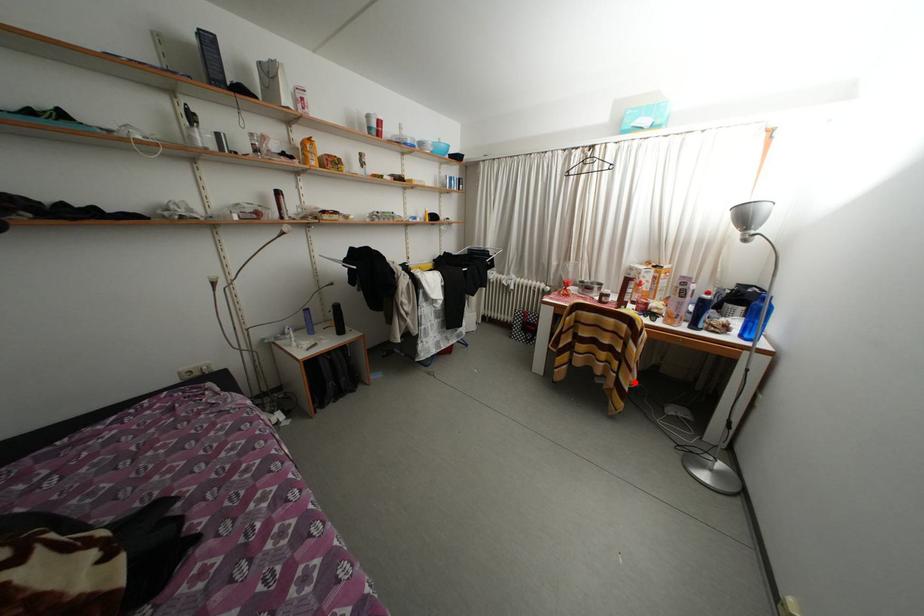
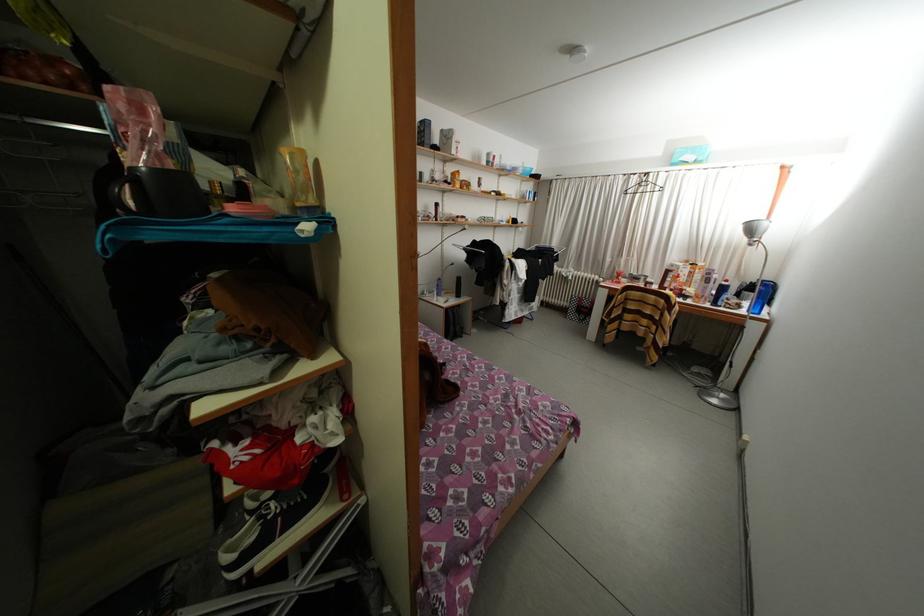
Find the pixel in the second image that matches the highlighted location in the first image.

(670, 342)